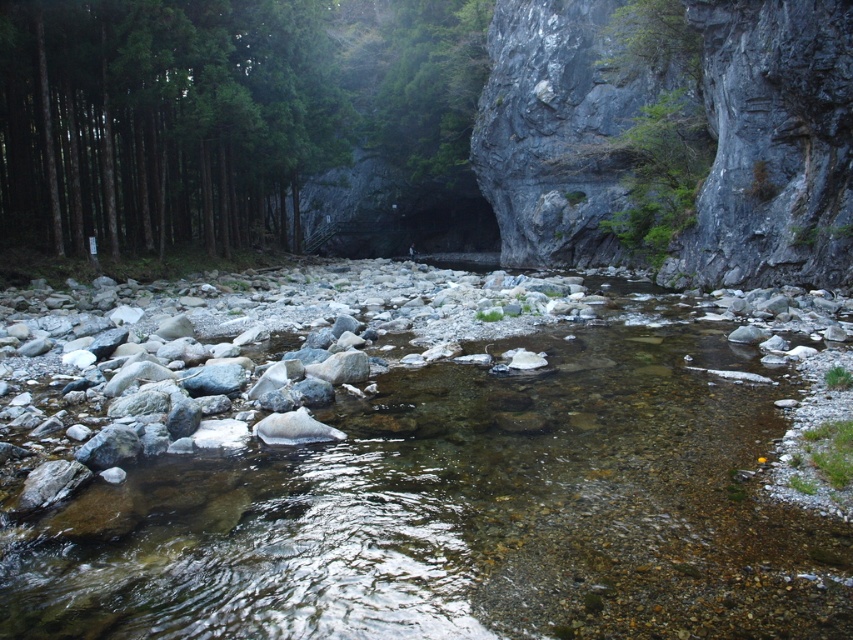
Does clear water at center have a greater height compared to green matte tree at left?

In fact, clear water at center may be shorter than green matte tree at left.

Can you confirm if clear water at center is smaller than green matte tree at left?

Indeed, clear water at center has a smaller size compared to green matte tree at left.

Between point (746, 506) and point (148, 192), which one is positioned behind?

The point (148, 192) is more distant.

Find the location of a particular element. clear water at center is located at coordinates (463, 513).